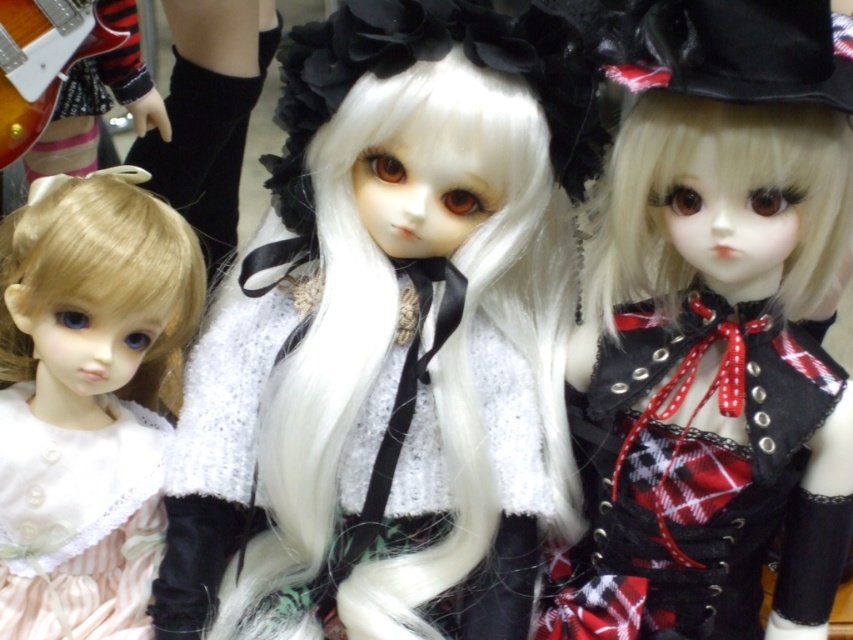
What is the 2D coordinate of the pastel striped fabric dress at left?

The pastel striped fabric dress at left is located at the 2D coordinate point of (86,401).

You are standing in front of the dolls and want to place a small decoration exactly at point (462, 116). If your hand can reach up to 30 inches, will you be able to reach that point?

The distance of point (462, 116) from viewer is 32.18 inches, so you cannot reach it with a hand that can only reach up to 30 inches.

In the image of the dolls, which dress has a greater width between the white lace dress at center and the pale pink lace dress at left?

The white lace dress at center has a greater width than the pale pink lace dress at left.